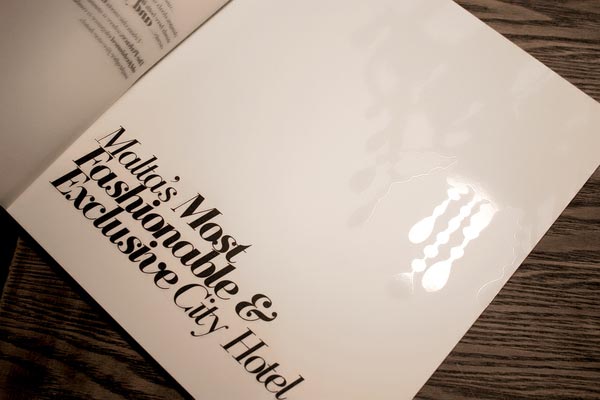
In order to click on table in this screenshot , I will do `click(545, 350)`.